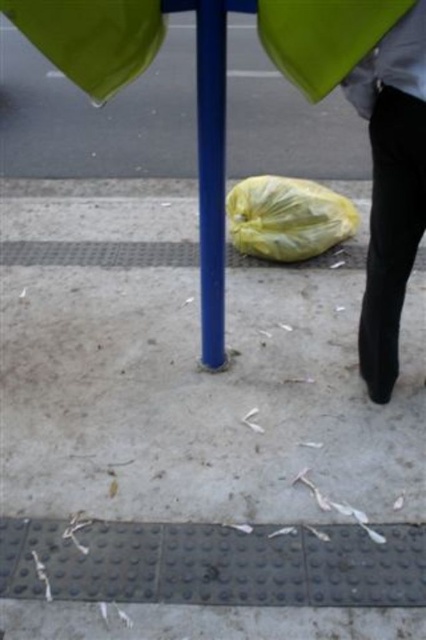
Is yellow matte plastic bag at center to the left of yellow plastic bag at lower center from the viewer's perspective?

Indeed, yellow matte plastic bag at center is positioned on the left side of yellow plastic bag at lower center.

What do you see at coordinates (325, 38) in the screenshot? I see `yellow matte plastic bag at center` at bounding box center [325, 38].

Does point (307, 20) come closer to viewer compared to point (285, 193)?

That is True.

This screenshot has height=640, width=426. Identify the location of yellow matte plastic bag at center. (325, 38).

Does blue glossy pole at center appear over yellow plastic bag at lower center?

No.

Is point (210, 148) more distant than point (261, 198)?

That is False.

Image resolution: width=426 pixels, height=640 pixels. In order to click on blue glossy pole at center in this screenshot , I will do `click(210, 173)`.

Who is more distant from viewer, (319, 20) or (164, 3)?

The point (164, 3) is behind.

Consider the image. Does yellow matte plastic bag at center have a greater height compared to blue glossy pole at center?

Incorrect, yellow matte plastic bag at center's height is not larger of blue glossy pole at center's.

This screenshot has width=426, height=640. Describe the element at coordinates (325, 38) in the screenshot. I see `yellow matte plastic bag at center` at that location.

Image resolution: width=426 pixels, height=640 pixels. Find the location of `yellow matte plastic bag at center`. yellow matte plastic bag at center is located at coordinates (325, 38).